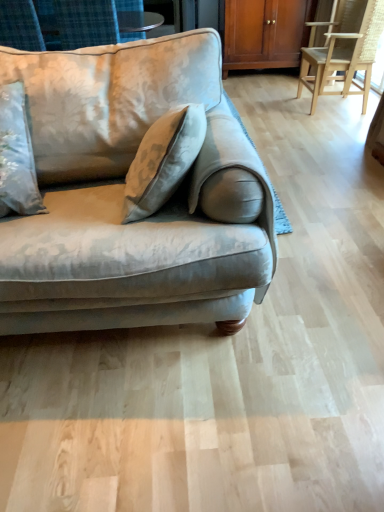
Question: Is velvet beige couch at left to the left of wooden cabinet at upper center from the viewer's perspective?

Choices:
 (A) yes
 (B) no

Answer: (A)

Question: From a real-world perspective, is velvet beige couch at left below wooden cabinet at upper center?

Choices:
 (A) yes
 (B) no

Answer: (B)

Question: Is velvet beige couch at left positioned beyond the bounds of wooden cabinet at upper center?

Choices:
 (A) yes
 (B) no

Answer: (A)

Question: Does velvet beige couch at left have a smaller size compared to wooden cabinet at upper center?

Choices:
 (A) yes
 (B) no

Answer: (B)

Question: Is velvet beige couch at left wider than wooden cabinet at upper center?

Choices:
 (A) yes
 (B) no

Answer: (A)

Question: From a real-world perspective, is velvet beige couch at left physically located above or below wooden cabinet at upper center?

Choices:
 (A) above
 (B) below

Answer: (A)

Question: Considering the positions of velvet beige couch at left and wooden cabinet at upper center in the image, is velvet beige couch at left wider or thinner than wooden cabinet at upper center?

Choices:
 (A) thin
 (B) wide

Answer: (B)

Question: Would you say velvet beige couch at left is inside or outside wooden cabinet at upper center?

Choices:
 (A) inside
 (B) outside

Answer: (B)

Question: Would you say velvet beige couch at left is to the left or to the right of wooden cabinet at upper center in the picture?

Choices:
 (A) left
 (B) right

Answer: (A)

Question: From a real-world perspective, is wooden cabinet at upper center positioned above or below velvet beige couch at left?

Choices:
 (A) above
 (B) below

Answer: (B)

Question: Is wooden cabinet at upper center bigger or smaller than velvet beige couch at left?

Choices:
 (A) small
 (B) big

Answer: (A)

Question: From their relative heights in the image, would you say wooden cabinet at upper center is taller or shorter than velvet beige couch at left?

Choices:
 (A) tall
 (B) short

Answer: (B)

Question: Is wooden cabinet at upper center inside the boundaries of velvet beige couch at left, or outside?

Choices:
 (A) inside
 (B) outside

Answer: (B)

Question: From a real-world perspective, is velvet beige couch at left above or below light brown wooden chair at right?

Choices:
 (A) below
 (B) above

Answer: (B)

Question: In terms of height, does velvet beige couch at left look taller or shorter compared to light brown wooden chair at right?

Choices:
 (A) tall
 (B) short

Answer: (A)